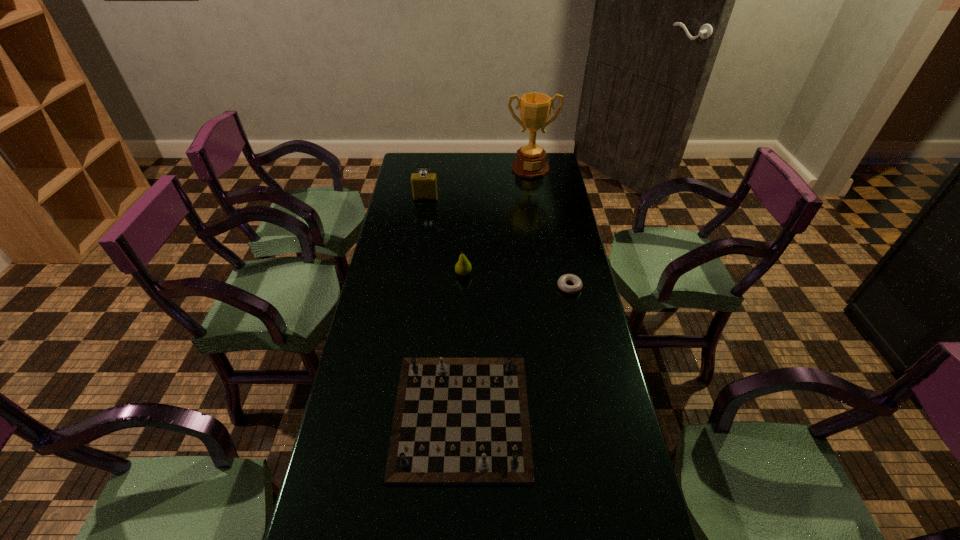
In the image, there is a desktop. Identify the location of vacant space at the right edge. The width and height of the screenshot is (960, 540). (624, 454).

The image size is (960, 540). In order to click on blank space at the far left corner in this screenshot , I will do `click(433, 157)`.

Where is `free space that is in between the nearest object and the perfume`? The width and height of the screenshot is (960, 540). free space that is in between the nearest object and the perfume is located at coordinates (444, 307).

The height and width of the screenshot is (540, 960). I want to click on free space between the farthest object and the second shortest object, so click(x=496, y=292).

Identify the location of free spot between the doughnut and the award. This screenshot has height=540, width=960. pyautogui.click(x=550, y=227).

Locate an element on the screen. The image size is (960, 540). empty location between the award and the third tallest object is located at coordinates (497, 221).

At what (x,y) coordinates should I click in order to perform the action: click on blank region between the third shortest object and the nearest object. Please return your answer as a coordinate pair (x, y). Looking at the image, I should click on (463, 345).

Where is `vacant space that's between the perfume and the farthest object`? The image size is (960, 540). vacant space that's between the perfume and the farthest object is located at coordinates (478, 183).

Where is `vacant space that's between the chessboard and the pear`? The image size is (960, 540). vacant space that's between the chessboard and the pear is located at coordinates (463, 345).

You are a GUI agent. You are given a task and a screenshot of the screen. Output one action in this format:
    pyautogui.click(x=<x>, y=<y>)
    Task: Click on the vacant space that's between the doughnut and the second tallest object
    This screenshot has width=960, height=540.
    Given the screenshot: What is the action you would take?
    pyautogui.click(x=497, y=242)